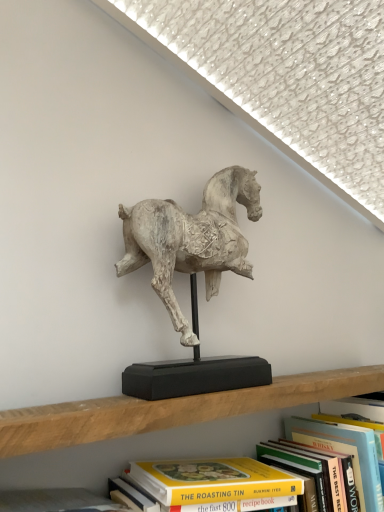
Question: Is hardcover book at upper center, arranged as the 1th book when viewed from the right, positioned in front of yellow paperback book at center, positioned as the 2th book in right-to-left order?

Choices:
 (A) yes
 (B) no

Answer: (B)

Question: Does hardcover book at upper center, the 2th book in the left-to-right sequence, have a larger size compared to yellow paperback book at center, placed as the first book when sorted from left to right?

Choices:
 (A) no
 (B) yes

Answer: (A)

Question: From a real-world perspective, is hardcover book at upper center, the 2th book in the left-to-right sequence, under yellow paperback book at center, positioned as the 2th book in right-to-left order?

Choices:
 (A) no
 (B) yes

Answer: (B)

Question: Is hardcover book at upper center, the 2th book in the left-to-right sequence, placed right next to yellow paperback book at center, placed as the first book when sorted from left to right?

Choices:
 (A) yes
 (B) no

Answer: (A)

Question: Is the depth of hardcover book at upper center, arranged as the 1th book when viewed from the right, greater than that of yellow paperback book at center, placed as the first book when sorted from left to right?

Choices:
 (A) yes
 (B) no

Answer: (A)

Question: From the image's perspective, is hardcover book at upper center, arranged as the 1th book when viewed from the right, positioned above or below white textured horse at center?

Choices:
 (A) above
 (B) below

Answer: (B)

Question: Relative to white textured horse at center, is hardcover book at upper center, arranged as the 1th book when viewed from the right, in front or behind?

Choices:
 (A) front
 (B) behind

Answer: (B)

Question: From a real-world perspective, relative to white textured horse at center, is hardcover book at upper center, the 2th book in the left-to-right sequence, vertically above or below?

Choices:
 (A) below
 (B) above

Answer: (A)

Question: Considering the positions of hardcover book at upper center, the 2th book in the left-to-right sequence, and white textured horse at center in the image, is hardcover book at upper center, the 2th book in the left-to-right sequence, wider or thinner than white textured horse at center?

Choices:
 (A) wide
 (B) thin

Answer: (A)

Question: From the image's perspective, is hardcover book at upper center, the 2th book in the left-to-right sequence, located above or below yellow paperback book at center, positioned as the 2th book in right-to-left order?

Choices:
 (A) below
 (B) above

Answer: (A)

Question: Considering the positions of hardcover book at upper center, arranged as the 1th book when viewed from the right, and yellow paperback book at center, positioned as the 2th book in right-to-left order, in the image, is hardcover book at upper center, arranged as the 1th book when viewed from the right, bigger or smaller than yellow paperback book at center, positioned as the 2th book in right-to-left order,?

Choices:
 (A) big
 (B) small

Answer: (B)

Question: Is hardcover book at upper center, the 2th book in the left-to-right sequence, wider or thinner than yellow paperback book at center, placed as the first book when sorted from left to right?

Choices:
 (A) thin
 (B) wide

Answer: (B)

Question: Considering the positions of hardcover book at upper center, the 2th book in the left-to-right sequence, and yellow paperback book at center, positioned as the 2th book in right-to-left order, in the image, is hardcover book at upper center, the 2th book in the left-to-right sequence, taller or shorter than yellow paperback book at center, positioned as the 2th book in right-to-left order,?

Choices:
 (A) tall
 (B) short

Answer: (A)

Question: From a real-world perspective, relative to hardcover book at upper center, arranged as the 1th book when viewed from the right, is yellow paperback book at center, placed as the first book when sorted from left to right, vertically above or below?

Choices:
 (A) above
 (B) below

Answer: (A)

Question: Considering the positions of yellow paperback book at center, placed as the first book when sorted from left to right, and hardcover book at upper center, the 2th book in the left-to-right sequence, in the image, is yellow paperback book at center, placed as the first book when sorted from left to right, taller or shorter than hardcover book at upper center, the 2th book in the left-to-right sequence,?

Choices:
 (A) tall
 (B) short

Answer: (B)